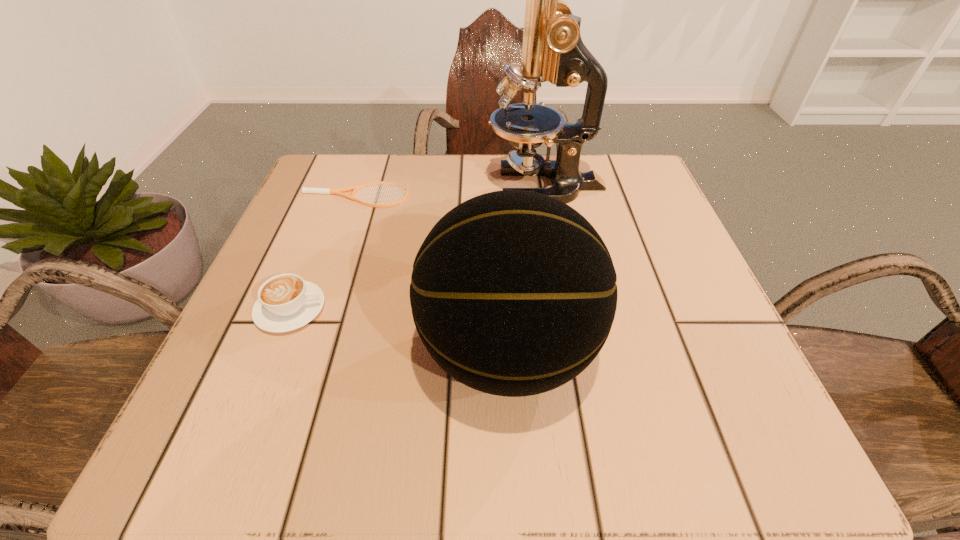
Where is `the tallest object`? This screenshot has height=540, width=960. the tallest object is located at coordinates (552, 49).

This screenshot has width=960, height=540. Identify the location of the second tallest object. (513, 293).

Find the location of a particular element. The height and width of the screenshot is (540, 960). the second shortest object is located at coordinates (286, 302).

Where is `tennis racket`? tennis racket is located at coordinates (331, 191).

Where is `vacant space located at the eyepiece of the tallest object`? vacant space located at the eyepiece of the tallest object is located at coordinates [x=436, y=186].

Identify the location of free point located 0.150m at the eyepiece of the tallest object. (418, 186).

Identify the location of vacant space located at the eyepiece of the tallest object. (356, 186).

I want to click on free point located on the right of the second tallest object, so click(732, 352).

Where is `vacant space situated on the side of the cappuccino with the handle`? The height and width of the screenshot is (540, 960). vacant space situated on the side of the cappuccino with the handle is located at coordinates (483, 309).

Find the location of a particular element. vacant region located 0.230m on the front of the tennis racket is located at coordinates (322, 292).